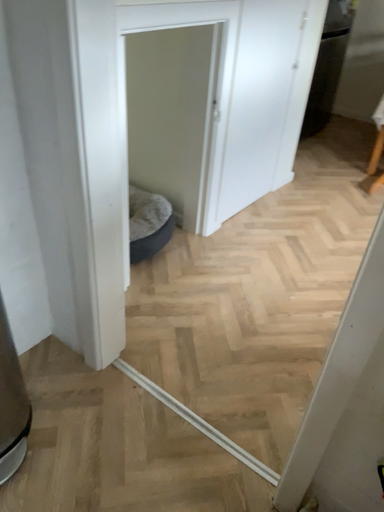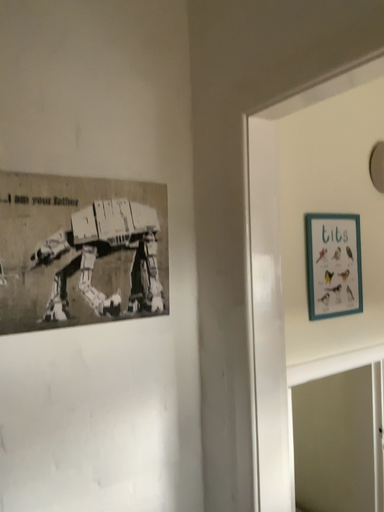
Question: How did the camera likely rotate when shooting the video?

Choices:
 (A) rotated upward
 (B) rotated downward

Answer: (A)